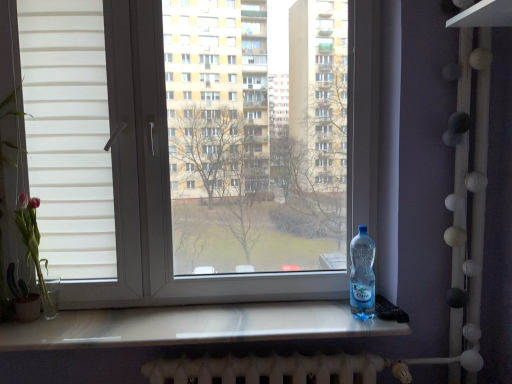
Question: Is pink glass vase at left touching transparent plastic bottle at right?

Choices:
 (A) yes
 (B) no

Answer: (B)

Question: Does pink glass vase at left have a lesser height compared to transparent plastic bottle at right?

Choices:
 (A) yes
 (B) no

Answer: (B)

Question: From the image's perspective, would you say pink glass vase at left is positioned over transparent plastic bottle at right?

Choices:
 (A) no
 (B) yes

Answer: (B)

Question: Is pink glass vase at left not inside transparent plastic bottle at right?

Choices:
 (A) no
 (B) yes

Answer: (B)

Question: Does pink glass vase at left appear on the left side of transparent plastic bottle at right?

Choices:
 (A) no
 (B) yes

Answer: (B)

Question: Is pink glass vase at left facing away from transparent plastic bottle at right?

Choices:
 (A) yes
 (B) no

Answer: (B)

Question: From a real-world perspective, is transparent plastic bottle at right located beneath pink glass vase at left?

Choices:
 (A) yes
 (B) no

Answer: (A)

Question: Is transparent plastic bottle at right to the right of pink glass vase at left from the viewer's perspective?

Choices:
 (A) no
 (B) yes

Answer: (B)

Question: From a real-world perspective, is transparent plastic bottle at right physically above pink glass vase at left?

Choices:
 (A) no
 (B) yes

Answer: (A)

Question: Is transparent plastic bottle at right thinner than pink glass vase at left?

Choices:
 (A) yes
 (B) no

Answer: (B)

Question: Is transparent plastic bottle at right not within pink glass vase at left?

Choices:
 (A) yes
 (B) no

Answer: (A)

Question: Considering the relative sizes of transparent plastic bottle at right and pink glass vase at left in the image provided, is transparent plastic bottle at right taller than pink glass vase at left?

Choices:
 (A) no
 (B) yes

Answer: (A)

Question: Is transparent plastic window at center bigger than transparent plastic bottle at right?

Choices:
 (A) no
 (B) yes

Answer: (B)